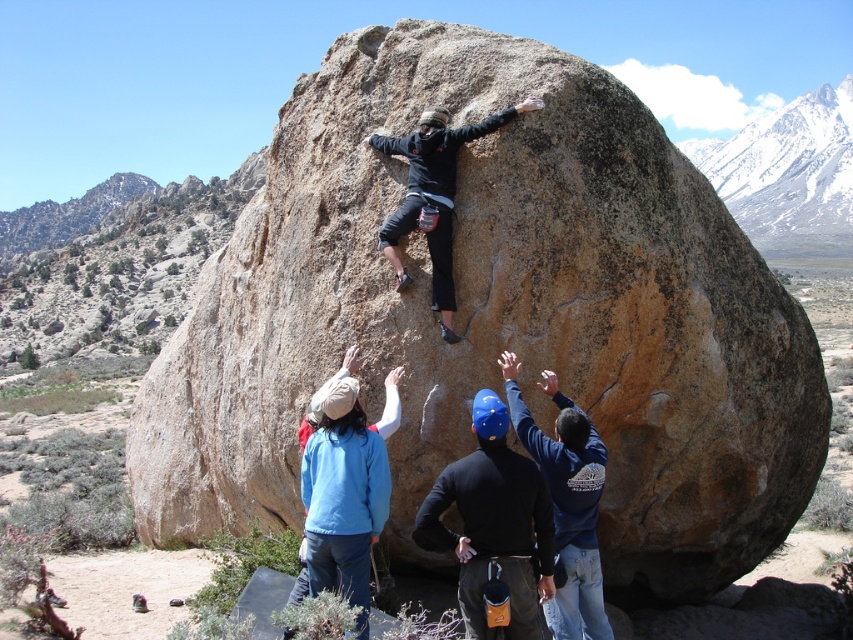
Question: Does black matte shirt at center have a smaller size compared to blue fleece jacket at center?

Choices:
 (A) no
 (B) yes

Answer: (B)

Question: Is blue fleece jacket at center thinner than blue helmet at upper center?

Choices:
 (A) yes
 (B) no

Answer: (B)

Question: Where is black matte shirt at center located in relation to blue fleece jacket at center in the image?

Choices:
 (A) above
 (B) below

Answer: (B)

Question: Estimate the real-world distances between objects in this image. Which object is closer to the matte black jacket at center?

Choices:
 (A) black matte shirt at center
 (B) blue fleece jacket at center

Answer: (B)

Question: Which point is farther to the camera?

Choices:
 (A) (506, 518)
 (B) (573, 528)

Answer: (B)

Question: Estimate the real-world distances between objects in this image. Which object is closer to the blue helmet at upper center?

Choices:
 (A) black matte shirt at center
 (B) blue fleece jacket at center

Answer: (A)